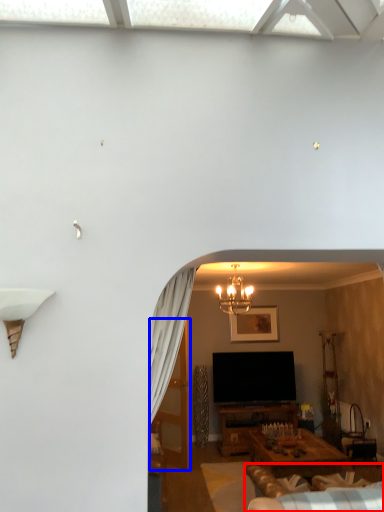
Question: Which object appears farthest to the camera in this image, couch (highlighted by a red box) or glass door (highlighted by a blue box)?

Choices:
 (A) couch
 (B) glass door

Answer: (B)